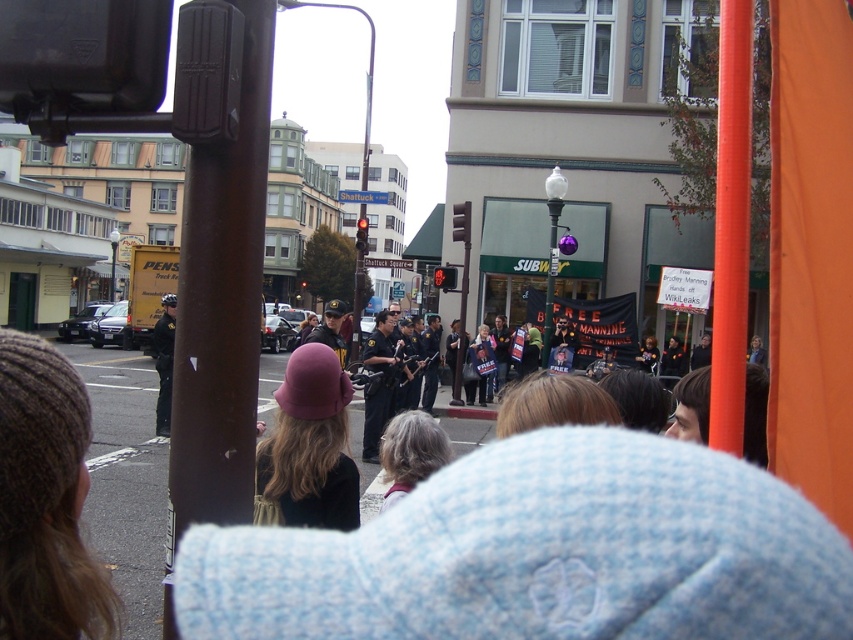
You are a photographer trying to capture a clear shot of the orange plastic pole at right and the gray hair at center in the protest scene. Which object should you focus on first if you want to ensure both are in focus, considering their sizes?

The orange plastic pole at right has a larger size compared to gray hair at center, so you should focus on the orange plastic pole at right first to ensure both are in focus.

You are a photographer trying to capture the protest scene. You notice an orange plastic pole at right and a metallic uniform at center. Which object would appear smaller in your photo?

The orange plastic pole at right appears smaller in the photo because it has a smaller size compared to the metallic uniform at center.